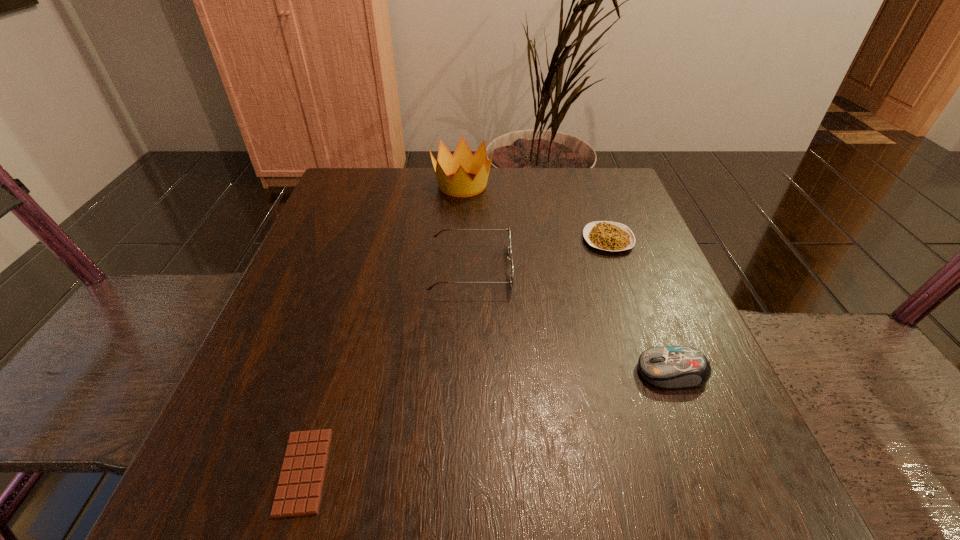
This screenshot has height=540, width=960. Identify the location of vacant region located on the wheel side of the third tallest object. (381, 372).

Image resolution: width=960 pixels, height=540 pixels. In order to click on free space located on the wheel side of the third tallest object in this screenshot , I will do `click(561, 372)`.

At what (x,y) coordinates should I click in order to perform the action: click on vacant space situated 0.160m on the wheel side of the third tallest object. Please return your answer as a coordinate pair (x, y). Looking at the image, I should click on (535, 372).

Identify the location of vacant area situated 0.170m on the left of the fourth tallest object. This screenshot has height=540, width=960. (503, 240).

Find the location of a particular element. The width and height of the screenshot is (960, 540). vacant space located 0.120m on the back of the candy bar is located at coordinates (336, 361).

At what (x,y) coordinates should I click in order to perform the action: click on object present at the far edge. Please return your answer as a coordinate pair (x, y). Looking at the image, I should click on (462, 162).

Where is `object that is at the near edge`? This screenshot has width=960, height=540. object that is at the near edge is located at coordinates (298, 493).

The width and height of the screenshot is (960, 540). What are the coordinates of `object present at the left edge` in the screenshot? It's located at (298, 493).

The image size is (960, 540). I want to click on computer mouse present at the right edge, so click(x=670, y=367).

At what (x,y) coordinates should I click in order to perform the action: click on legume located in the right edge section of the desktop. Please return your answer as a coordinate pair (x, y). The width and height of the screenshot is (960, 540). Looking at the image, I should click on (610, 236).